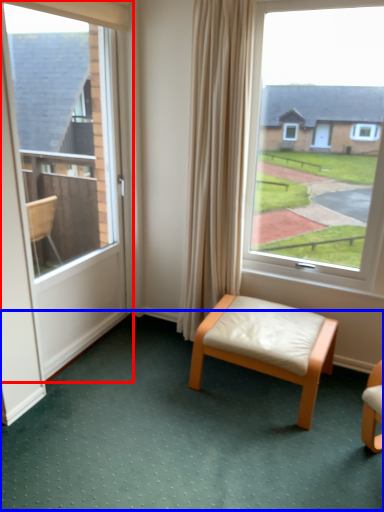
Question: Which object appears closest to the camera in this image, door (highlighted by a red box) or golf course (highlighted by a blue box)?

Choices:
 (A) door
 (B) golf course

Answer: (B)